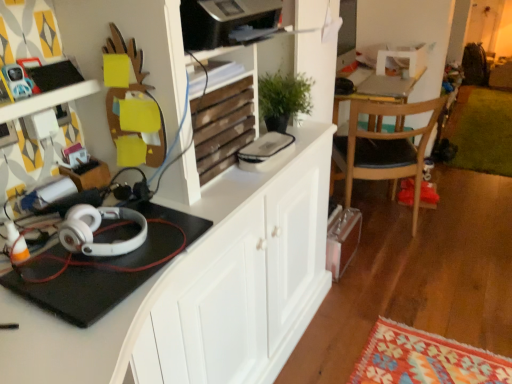
Question: Can you confirm if green plush rug at lower right is bigger than white matte cabinet at center?

Choices:
 (A) no
 (B) yes

Answer: (A)

Question: Is green plush rug at lower right not close to white matte cabinet at center?

Choices:
 (A) no
 (B) yes

Answer: (B)

Question: Is green plush rug at lower right taller than white matte cabinet at center?

Choices:
 (A) no
 (B) yes

Answer: (A)

Question: Is green plush rug at lower right at the right side of white matte cabinet at center?

Choices:
 (A) yes
 (B) no

Answer: (A)

Question: From a real-world perspective, is green plush rug at lower right located beneath white matte cabinet at center?

Choices:
 (A) yes
 (B) no

Answer: (A)

Question: Does green plush rug at lower right come behind white matte cabinet at center?

Choices:
 (A) yes
 (B) no

Answer: (A)

Question: Considering the relative sizes of green plush rug at lower right and wooden chair with black seat cushion at right in the image provided, is green plush rug at lower right wider than wooden chair with black seat cushion at right?

Choices:
 (A) yes
 (B) no

Answer: (A)

Question: From the image's perspective, is green plush rug at lower right below wooden chair with black seat cushion at right?

Choices:
 (A) no
 (B) yes

Answer: (A)

Question: Does green plush rug at lower right have a greater height compared to wooden chair with black seat cushion at right?

Choices:
 (A) no
 (B) yes

Answer: (A)

Question: Is green plush rug at lower right completely or partially outside of wooden chair with black seat cushion at right?

Choices:
 (A) no
 (B) yes

Answer: (B)

Question: Is green plush rug at lower right to the left of wooden chair with black seat cushion at right from the viewer's perspective?

Choices:
 (A) yes
 (B) no

Answer: (B)

Question: From the image's perspective, would you say green plush rug at lower right is positioned over wooden chair with black seat cushion at right?

Choices:
 (A) no
 (B) yes

Answer: (B)

Question: Considering the relative sizes of wooden at upper center and white matte headphones at left in the image provided, is wooden at upper center thinner than white matte headphones at left?

Choices:
 (A) no
 (B) yes

Answer: (A)